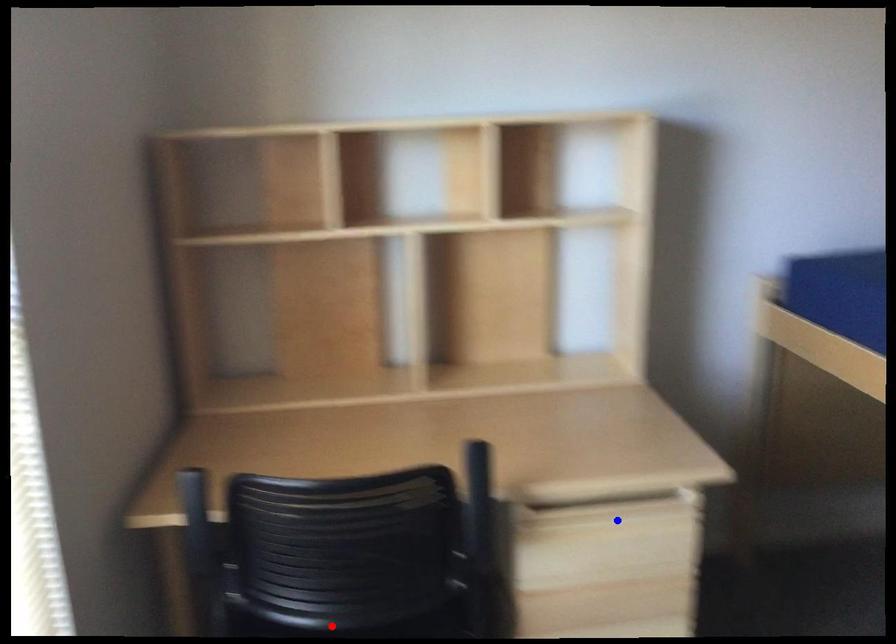
Question: Which of the two points in the image is closer to the camera?

Choices:
 (A) Blue point is closer.
 (B) Red point is closer.

Answer: (B)